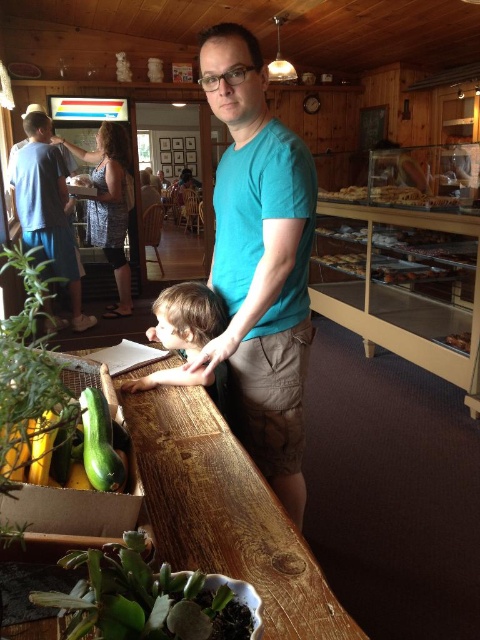
Question: Which point is closer to the camera?

Choices:
 (A) golden brown pastry at center
 (B) translucent glass pastries at upper right

Answer: (A)

Question: Can you confirm if teal cotton shirt at center is bigger than golden brown pastry at center?

Choices:
 (A) no
 (B) yes

Answer: (B)

Question: Which of the following is the farthest from the observer?

Choices:
 (A) teal cotton shirt at center
 (B) translucent glass pastries at upper right
 (C) green matte succulent at lower left
 (D) matte blue shirt at center

Answer: (D)

Question: Does smooth brown hair at center have a lesser width compared to golden brown pastry at center?

Choices:
 (A) no
 (B) yes

Answer: (A)

Question: Which point is farther to the camera?

Choices:
 (A) translucent glass pastries at upper right
 (B) golden brown pastry at center
 (C) matte blue shirt at center
 (D) smooth brown hair at center

Answer: (C)

Question: Is teal cotton shirt at center to the right of smooth brown hair at center from the viewer's perspective?

Choices:
 (A) no
 (B) yes

Answer: (B)